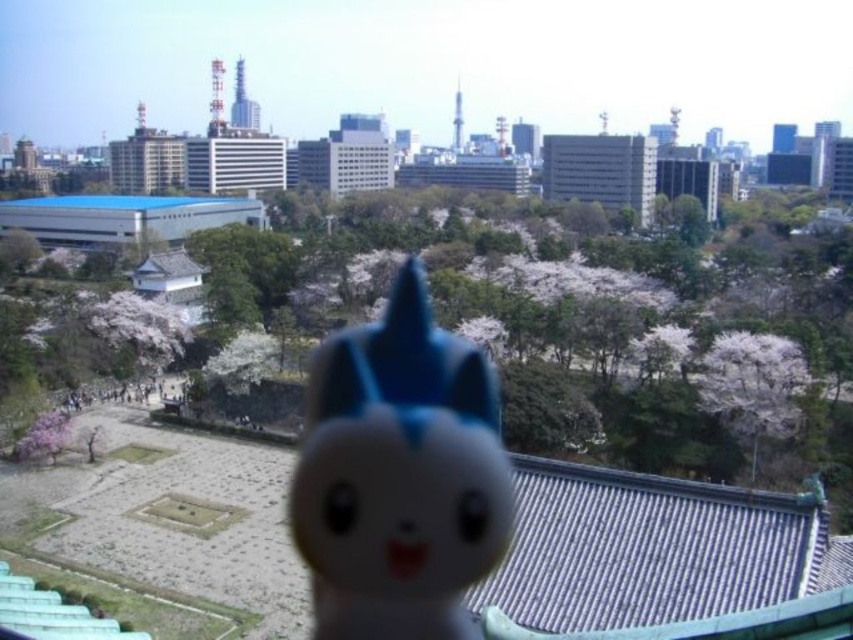
Question: Which of the following is the closest to the observer?

Choices:
 (A) (462, 429)
 (B) (775, 410)
 (C) (824, 458)

Answer: (A)

Question: Which object appears closest to the camera in this image?

Choices:
 (A) blue matte plush toy at center
 (B) pink blossoms at center
 (C) white blossoms at center

Answer: (A)

Question: Does white blossoms at center appear under blue matte plush toy at center?

Choices:
 (A) yes
 (B) no

Answer: (B)

Question: Can you confirm if white blossoms at center is positioned above blue matte plush toy at center?

Choices:
 (A) yes
 (B) no

Answer: (A)

Question: Can you confirm if white blossoms at center is wider than pink blossoms at center?

Choices:
 (A) no
 (B) yes

Answer: (B)

Question: Which is farther from the blue matte plush toy at center?

Choices:
 (A) white blossoms at center
 (B) pink blossoms at center

Answer: (A)